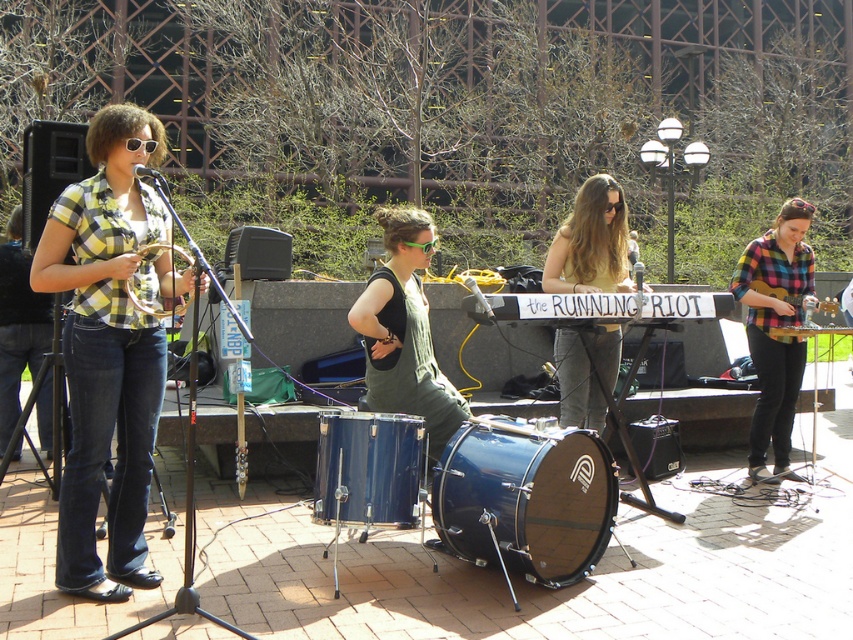
You are a photographer positioned at the front of the stage. You want to take a photo that includes both the point at (775, 304) and the point at (402, 467). Which point should you focus on first to ensure both are in focus?

You should focus on the point at (402, 467) first because it is closer to you than the point at (775, 304), which is further away. By focusing on the closer point, the depth of field may still capture the further point in focus.

You are a photographer at the performance. You need to capture a photo that includes both the checkered fabric shirt at left and the matte green dress at center. Based on their positions, which one should you focus on first to ensure both are in frame?

The checkered fabric shirt at left is positioned on the left side of the matte green dress at center. To include both in the frame, focus on the checkered fabric shirt at left first as it is on the left, then adjust to include the matte green dress at center on the right side of the shirt.